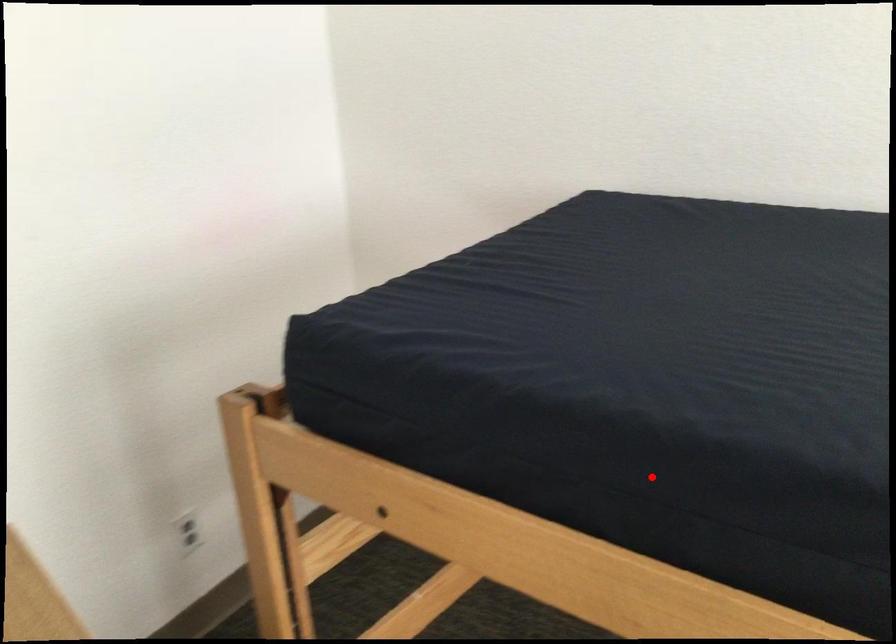
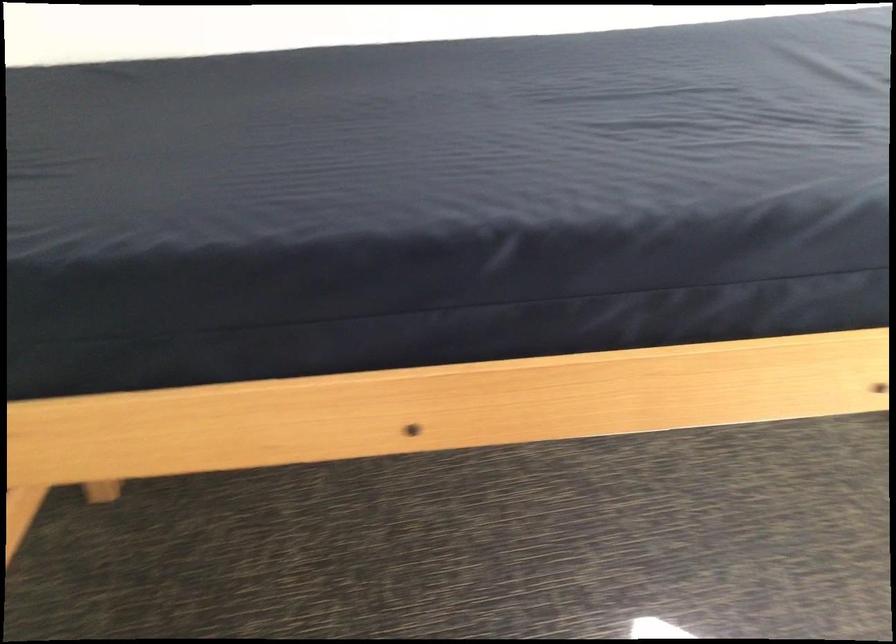
Locate, in the second image, the point that corresponds to the highlighted location in the first image.

(254, 308)